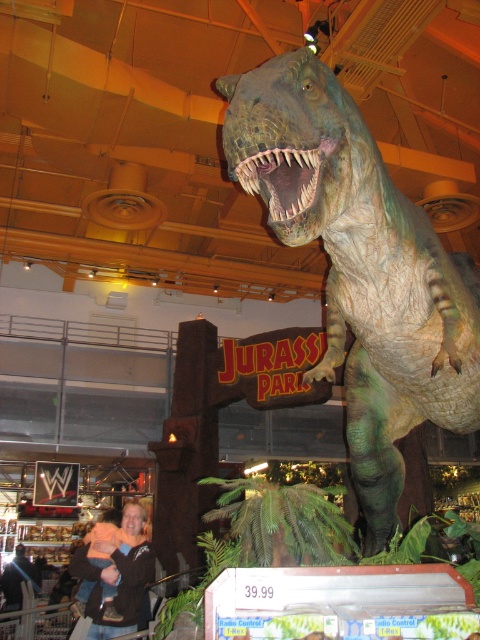
Between point (350, 266) and point (124, 620), which one is positioned behind?

The point (124, 620) is behind.

Between green textured dinosaur at center and dark brown leather jacket at lower left, which one appears on the left side from the viewer's perspective?

dark brown leather jacket at lower left is more to the left.

Identify the location of green textured dinosaur at center. (x=359, y=268).

Image resolution: width=480 pixels, height=640 pixels. Identify the location of green textured dinosaur at center. (359, 268).